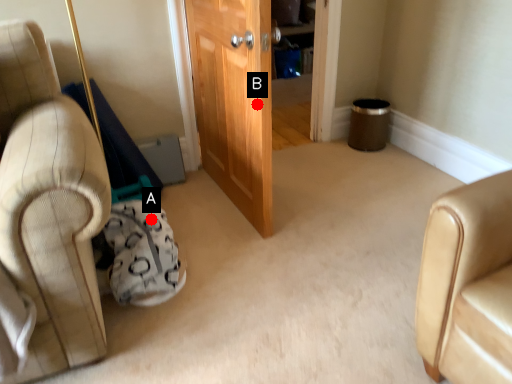
Question: Two points are circled on the image, labeled by A and B beside each circle. Which of the following is the farthest from the observer?

Choices:
 (A) A is further
 (B) B is further

Answer: (A)